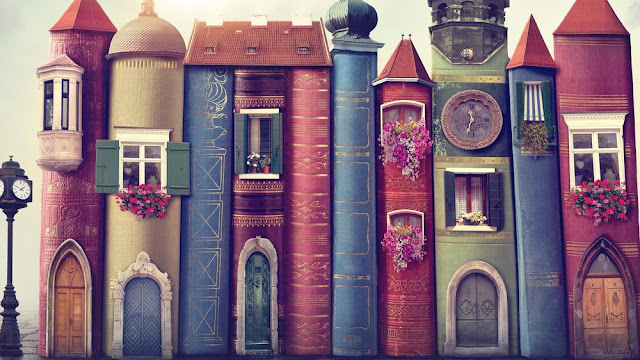
Image resolution: width=640 pixels, height=360 pixels. I want to click on clock, so click(460, 120).